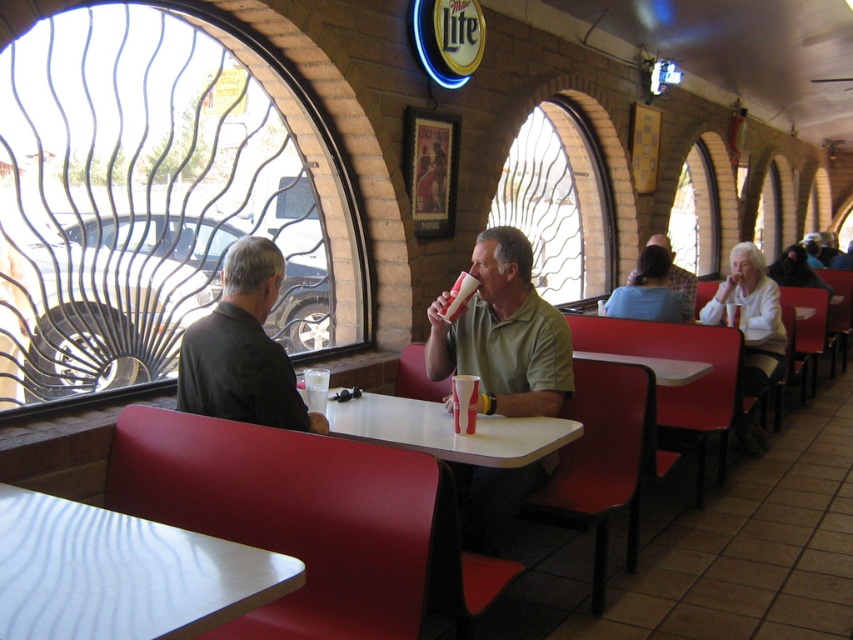
Can you confirm if matte green polo shirt at center is thinner than white paper cup at table left?

No, matte green polo shirt at center is not thinner than white paper cup at table left.

The image size is (853, 640). I want to click on matte green polo shirt at center, so click(503, 333).

Locate an element on the screen. This screenshot has height=640, width=853. matte green polo shirt at center is located at coordinates (503, 333).

Is white textured table at lower left in front of white paper cup at table left?

Yes, white textured table at lower left is closer to the viewer.

Which is behind, point (119, 632) or point (310, 374)?

The point (310, 374) is behind.

What are the coordinates of `white textured table at lower left` in the screenshot? It's located at (122, 573).

Between white textured table at lower left and matte green polo shirt at center, which one is positioned higher?

matte green polo shirt at center is higher up.

Between white textured table at lower left and matte green polo shirt at center, which one appears on the right side from the viewer's perspective?

From the viewer's perspective, matte green polo shirt at center appears more on the right side.

The height and width of the screenshot is (640, 853). Describe the element at coordinates (122, 573) in the screenshot. I see `white textured table at lower left` at that location.

Locate an element on the screen. The image size is (853, 640). white textured table at lower left is located at coordinates (122, 573).